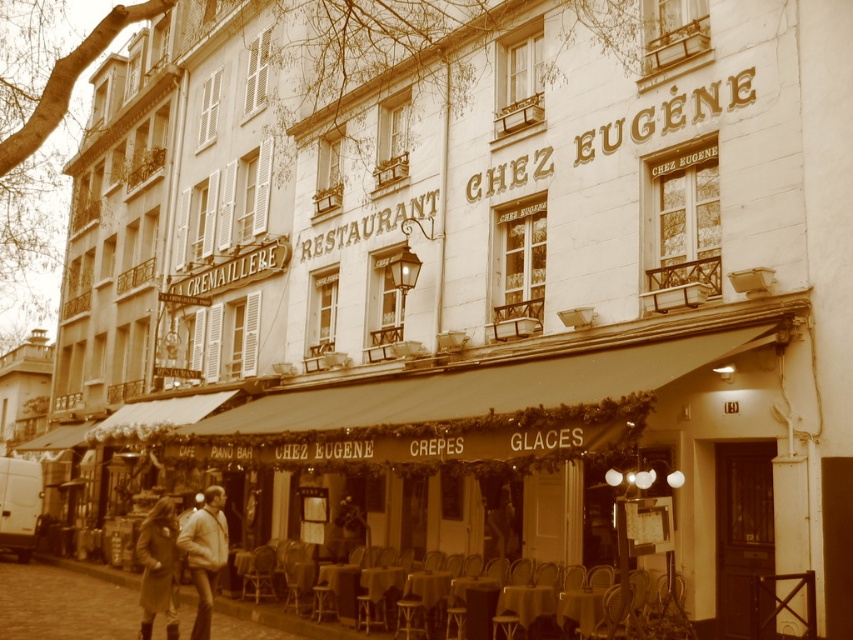
You are a customer entering Chez Eugene and want to grab your light brown leather jacket at lower left before sitting down. Is the metallic silver chair at lower center blocking your path to the jacket?

The metallic silver chair at lower center is closer to the viewer than the light brown leather jacket at lower left, so the chair is in front of the jacket. Therefore, the metallic silver chair at lower center would block your path to the light brown leather jacket at lower left.